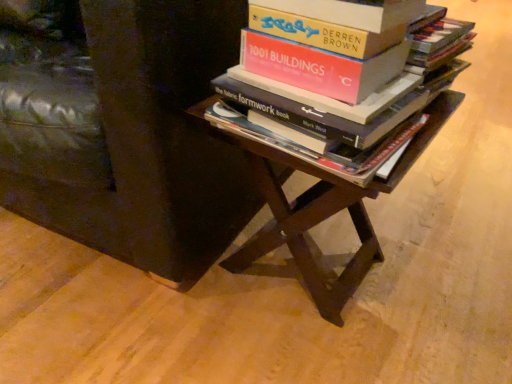
Locate an element on the screen. This screenshot has height=384, width=512. vacant space that is to the left of brown wooden table at center is located at coordinates (151, 309).